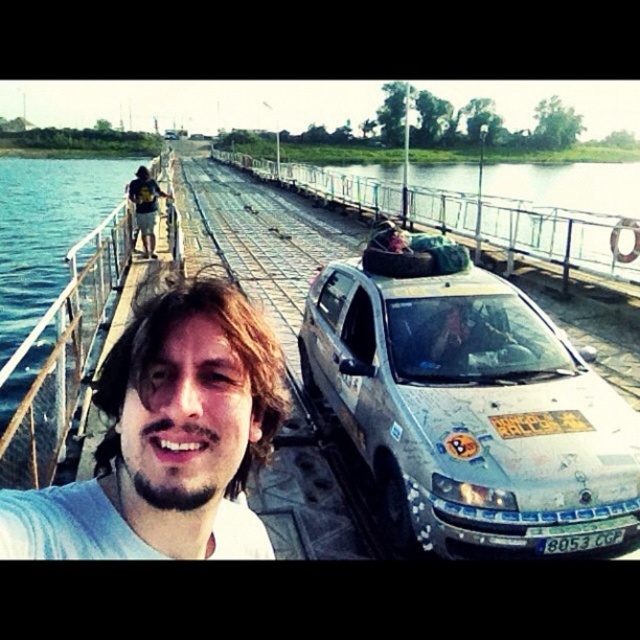
Question: Does light brown hair at center appear on the left side of white plastic license plate at center?

Choices:
 (A) no
 (B) yes

Answer: (B)

Question: Is light brown hair at center behind white plastic license plate at center?

Choices:
 (A) yes
 (B) no

Answer: (B)

Question: Estimate the real-world distances between objects in this image. Which object is farther from the white plastic license plate at center?

Choices:
 (A) silver metallic car at center
 (B) light brown hair at center

Answer: (B)

Question: Is silver metallic car at center further to camera compared to light brown hair at center?

Choices:
 (A) no
 (B) yes

Answer: (B)

Question: Estimate the real-world distances between objects in this image. Which object is closer to the white plastic license plate at center?

Choices:
 (A) light brown hair at center
 (B) silver metallic car at center

Answer: (B)

Question: Which of the following is the closest to the observer?

Choices:
 (A) silver metallic car at center
 (B) white plastic license plate at center
 (C) light brown hair at center

Answer: (C)